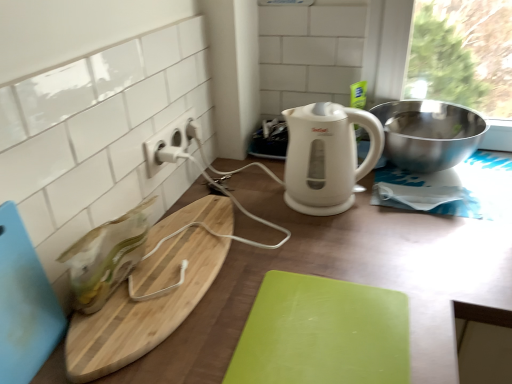
I want to click on wooden cutting board at center, so click(346, 280).

Measure the distance between wooden cutting board at center and camera.

wooden cutting board at center is 22.77 inches from camera.

This screenshot has width=512, height=384. I want to click on white glossy electric kettle at center, so click(327, 157).

Image resolution: width=512 pixels, height=384 pixels. What do you see at coordinates (327, 157) in the screenshot?
I see `white glossy electric kettle at center` at bounding box center [327, 157].

How much space does natural wood cutting board at left, which is the 2th cutting board from left to right, occupy horizontally?

natural wood cutting board at left, which is the 2th cutting board from left to right, is 7.56 inches wide.

Measure the distance between point (10,273) and camera.

The distance of point (10,273) from camera is 22.17 inches.

The height and width of the screenshot is (384, 512). What do you see at coordinates (322, 333) in the screenshot?
I see `green matte cutting board at center, arranged as the 3th cutting board when viewed from the left` at bounding box center [322, 333].

Describe the element at coordinates (429, 133) in the screenshot. Image resolution: width=512 pixels, height=384 pixels. I see `polished stainless steel bowl at upper right` at that location.

The height and width of the screenshot is (384, 512). In order to click on wooden cutting board at center in this screenshot , I will do `click(346, 280)`.

In order to click on the 3rd cutting board to the left of the polished stainless steel bowl at upper right, counting from the anchor's position in this screenshot , I will do `click(24, 303)`.

Consider the image. From the image's perspective, is blue plastic cutting board at lower left, the first cutting board in the left-to-right sequence, beneath polished stainless steel bowl at upper right?

Yes, from the image's perspective, blue plastic cutting board at lower left, the first cutting board in the left-to-right sequence, is beneath polished stainless steel bowl at upper right.

What's the angular difference between blue plastic cutting board at lower left, the third cutting board positioned from the right, and polished stainless steel bowl at upper right's facing directions?

90 degrees separate the facing orientations of blue plastic cutting board at lower left, the third cutting board positioned from the right, and polished stainless steel bowl at upper right.

From a real-world perspective, who is located lower, blue plastic cutting board at lower left, the third cutting board positioned from the right, or polished stainless steel bowl at upper right?

polished stainless steel bowl at upper right.

Considering the positions of objects white plastic electric outlet at upper center and white glossy electric kettle at center in the image provided, who is behind, white plastic electric outlet at upper center or white glossy electric kettle at center?

white plastic electric outlet at upper center is more distant.

Is white plastic electric outlet at upper center positioned far away from white glossy electric kettle at center?

white plastic electric outlet at upper center is actually quite close to white glossy electric kettle at center.

Is point (172, 130) farther from camera compared to point (314, 174)?

That is True.

From a real-world perspective, is white plastic electric outlet at upper center physically located above or below white glossy electric kettle at center?

In terms of real-world spatial position, white plastic electric outlet at upper center is above white glossy electric kettle at center.

Consider the image. Does natural wood cutting board at left, the second cutting board when ordered from right to left, lie in front of blue plastic cutting board at lower left, the third cutting board positioned from the right?

No, natural wood cutting board at left, the second cutting board when ordered from right to left, is further to the viewer.

Which point is more distant from viewer, (175,239) or (7,321)?

The point (175,239) is behind.

From the image's perspective, which one is positioned lower, natural wood cutting board at left, which is the 2th cutting board from left to right, or blue plastic cutting board at lower left, the first cutting board in the left-to-right sequence?

blue plastic cutting board at lower left, the first cutting board in the left-to-right sequence.

Is natural wood cutting board at left, the second cutting board when ordered from right to left, positioned beyond the bounds of blue plastic cutting board at lower left, the first cutting board in the left-to-right sequence?

Yes.

Between natural wood cutting board at left, the second cutting board when ordered from right to left, and wooden cutting board at center, which one has more height?

wooden cutting board at center.

Considering the sizes of objects natural wood cutting board at left, which is the 2th cutting board from left to right, and wooden cutting board at center in the image provided, who is thinner, natural wood cutting board at left, which is the 2th cutting board from left to right, or wooden cutting board at center?

natural wood cutting board at left, which is the 2th cutting board from left to right.

Could you tell me if natural wood cutting board at left, which is the 2th cutting board from left to right, is turned towards wooden cutting board at center?

No, natural wood cutting board at left, which is the 2th cutting board from left to right, is not aimed at wooden cutting board at center.

Looking at this image, from the image's perspective, is green matte cutting board at center, arranged as the 3th cutting board when viewed from the left, located beneath natural wood cutting board at left, which is the 2th cutting board from left to right?

Yes, from the image's perspective, green matte cutting board at center, arranged as the 3th cutting board when viewed from the left, is below natural wood cutting board at left, which is the 2th cutting board from left to right.

Consider the image. Is green matte cutting board at center, arranged as the 3th cutting board when viewed from the left, far away from natural wood cutting board at left, which is the 2th cutting board from left to right?

green matte cutting board at center, arranged as the 3th cutting board when viewed from the left, is near natural wood cutting board at left, which is the 2th cutting board from left to right, not far away.

Does point (388, 347) come behind point (223, 241)?

No, (388, 347) is closer to viewer.

In terms of height, does green matte cutting board at center, marked as the first cutting board in a right-to-left arrangement, look taller or shorter compared to natural wood cutting board at left, which is the 2th cutting board from left to right?

Considering their sizes, green matte cutting board at center, marked as the first cutting board in a right-to-left arrangement, has less height than natural wood cutting board at left, which is the 2th cutting board from left to right.

Can you see green matte cutting board at center, marked as the first cutting board in a right-to-left arrangement, touching white glossy electric kettle at center?

green matte cutting board at center, marked as the first cutting board in a right-to-left arrangement, is not next to white glossy electric kettle at center, and they're not touching.

Is green matte cutting board at center, marked as the first cutting board in a right-to-left arrangement, oriented towards white glossy electric kettle at center?

No, green matte cutting board at center, marked as the first cutting board in a right-to-left arrangement, is not oriented towards white glossy electric kettle at center.

Is point (338, 299) closer or farther from the camera than point (312, 115)?

Point (338, 299) is positioned closer to the camera compared to point (312, 115).

From the image's perspective, which object appears higher, green matte cutting board at center, arranged as the 3th cutting board when viewed from the left, or white glossy electric kettle at center?

white glossy electric kettle at center.

Does natural wood cutting board at left, which is the 2th cutting board from left to right, have a greater height compared to green matte cutting board at center, arranged as the 3th cutting board when viewed from the left?

Yes.

Is natural wood cutting board at left, which is the 2th cutting board from left to right, spatially inside green matte cutting board at center, arranged as the 3th cutting board when viewed from the left, or outside of it?

The correct answer is: outside.

Which is more to the right, natural wood cutting board at left, the second cutting board when ordered from right to left, or green matte cutting board at center, marked as the first cutting board in a right-to-left arrangement?

Positioned to the right is green matte cutting board at center, marked as the first cutting board in a right-to-left arrangement.

Locate an element on the screen. The width and height of the screenshot is (512, 384). cutting board above the polished stainless steel bowl at upper right (from a real-world perspective) is located at coordinates 24,303.

What are the coordinates of `electric outlet that appears above the white glossy electric kettle at center (from the image's perspective)` in the screenshot? It's located at (168, 144).

When comparing their distances from blue plastic cutting board at lower left, the third cutting board positioned from the right, does polished stainless steel bowl at upper right or wooden cutting board at center seem further?

polished stainless steel bowl at upper right is further to blue plastic cutting board at lower left, the third cutting board positioned from the right.

When comparing their distances from natural wood cutting board at left, which is the 2th cutting board from left to right, does blue plastic cutting board at lower left, the first cutting board in the left-to-right sequence, or green matte cutting board at center, marked as the first cutting board in a right-to-left arrangement, seem further?

Based on the image, green matte cutting board at center, marked as the first cutting board in a right-to-left arrangement, appears to be further to natural wood cutting board at left, which is the 2th cutting board from left to right.

Looking at the image, which one is located closer to polished stainless steel bowl at upper right, wooden cutting board at center or white glossy electric kettle at center?

Among the two, white glossy electric kettle at center is located nearer to polished stainless steel bowl at upper right.

Estimate the real-world distances between objects in this image. Which object is further from polished stainless steel bowl at upper right, natural wood cutting board at left, the second cutting board when ordered from right to left, or green matte cutting board at center, marked as the first cutting board in a right-to-left arrangement?

Based on the image, natural wood cutting board at left, the second cutting board when ordered from right to left, appears to be further to polished stainless steel bowl at upper right.

When comparing their distances from wooden cutting board at center, does green matte cutting board at center, marked as the first cutting board in a right-to-left arrangement, or blue plastic cutting board at lower left, the third cutting board positioned from the right, seem closer?

green matte cutting board at center, marked as the first cutting board in a right-to-left arrangement, is closer to wooden cutting board at center.

Looking at the image, which one is located further to blue plastic cutting board at lower left, the first cutting board in the left-to-right sequence, white glossy electric kettle at center or green matte cutting board at center, arranged as the 3th cutting board when viewed from the left?

The object further to blue plastic cutting board at lower left, the first cutting board in the left-to-right sequence, is white glossy electric kettle at center.

Based on their spatial positions, is blue plastic cutting board at lower left, the first cutting board in the left-to-right sequence, or white plastic electric outlet at upper center closer to natural wood cutting board at left, which is the 2th cutting board from left to right?

The object closer to natural wood cutting board at left, which is the 2th cutting board from left to right, is blue plastic cutting board at lower left, the first cutting board in the left-to-right sequence.

Which object lies nearer to the anchor point natural wood cutting board at left, the second cutting board when ordered from right to left, white glossy electric kettle at center or wooden cutting board at center?

Among the two, wooden cutting board at center is located nearer to natural wood cutting board at left, the second cutting board when ordered from right to left.

At what (x,y) coordinates should I click in order to perform the action: click on electric outlet between blue plastic cutting board at lower left, the first cutting board in the left-to-right sequence, and wooden cutting board at center from left to right. Please return your answer as a coordinate pair (x, y). The width and height of the screenshot is (512, 384). Looking at the image, I should click on (168, 144).

Identify the location of kitchen appliance between polished stainless steel bowl at upper right and wooden cutting board at center vertically. (327, 157).

Identify the location of counter between natural wood cutting board at left, the second cutting board when ordered from right to left, and polished stainless steel bowl at upper right, in the horizontal direction. The image size is (512, 384). (346, 280).

This screenshot has height=384, width=512. I want to click on kitchen appliance situated between natural wood cutting board at left, the second cutting board when ordered from right to left, and wooden cutting board at center from left to right, so click(327, 157).